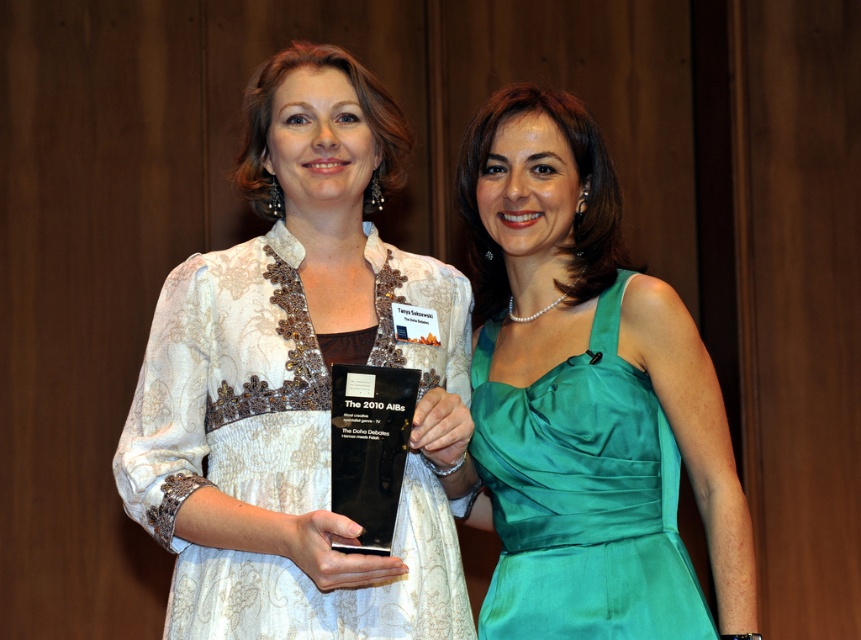
Is white lace dress at center above black glass award at center?

Correct, white lace dress at center is located above black glass award at center.

The height and width of the screenshot is (640, 861). Find the location of `white lace dress at center`. white lace dress at center is located at coordinates (299, 384).

Which is more to the right, emerald satin dress at right or black glass award at center?

emerald satin dress at right

Can you confirm if emerald satin dress at right is positioned to the right of black glass award at center?

Indeed, emerald satin dress at right is positioned on the right side of black glass award at center.

Is point (637, 518) more distant than point (381, 436)?

Yes, point (637, 518) is behind point (381, 436).

This screenshot has width=861, height=640. I want to click on emerald satin dress at right, so click(581, 497).

Does white lace dress at center have a greater width compared to emerald satin dress at right?

Correct, the width of white lace dress at center exceeds that of emerald satin dress at right.

Looking at this image, does white lace dress at center have a greater height compared to emerald satin dress at right?

Correct, white lace dress at center is much taller as emerald satin dress at right.

Identify the location of white lace dress at center. (299, 384).